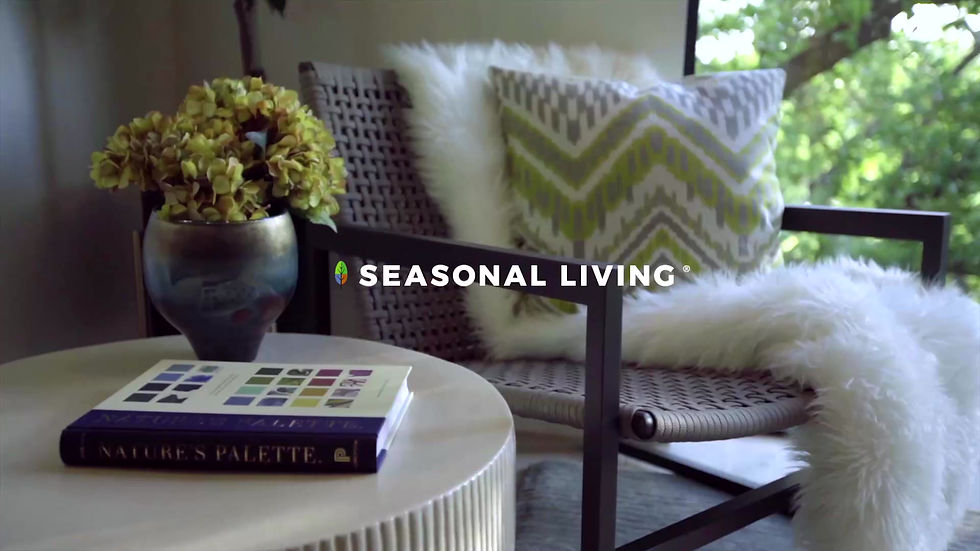
Locate an element on the screen. rug is located at coordinates (550, 504).